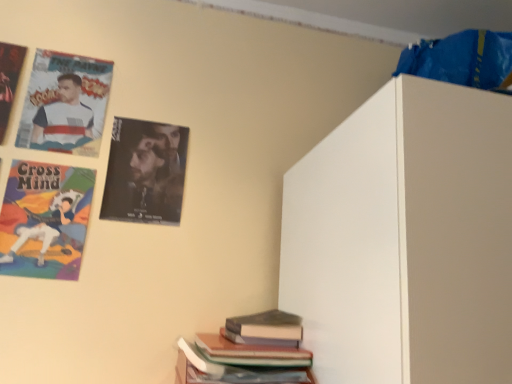
This screenshot has width=512, height=384. I want to click on hardcover book at lower right, the 1th book in the top-to-bottom sequence, so click(267, 325).

Where is `cartoon character poster at upper left`? The image size is (512, 384). cartoon character poster at upper left is located at coordinates (42, 232).

What is the approximate height of matte paper poster at upper left, the first poster from the left?

matte paper poster at upper left, the first poster from the left, is 12.12 inches tall.

Measure the distance between point (10, 51) and camera.

Point (10, 51) and camera are 3.83 feet apart from each other.

Measure the distance between point (148, 148) and camera.

3.94 feet.

In order to face black glossy poster at upper left, positioned as the first poster in right-to-left order, should I rotate leftwards or rightwards?

Turn left approximately 14.550 degrees to face it.

Where is `matte paper poster at upper left, the second poster when ordered from left to right`? matte paper poster at upper left, the second poster when ordered from left to right is located at coordinates (65, 103).

Is matte paper poster at upper left, positioned as the 3th poster in right-to-left order, to the right of matte paper poster at upper left, the second poster when ordered from left to right, from the viewer's perspective?

No.

Is matte paper poster at upper left, the first poster from the left, in contact with matte paper poster at upper left, the second poster when ordered from left to right?

matte paper poster at upper left, the first poster from the left, and matte paper poster at upper left, the second poster when ordered from left to right, are clearly separated.

From a real-world perspective, is matte paper poster at upper left, the first poster from the left, below matte paper poster at upper left, which is counted as the second poster, starting from the right?

Incorrect, from a real-world perspective, matte paper poster at upper left, the first poster from the left, is higher than matte paper poster at upper left, which is counted as the second poster, starting from the right.

Between black glossy poster at upper left, positioned as the first poster in right-to-left order, and matte paper poster at upper left, the first poster from the left, which one has smaller size?

Smaller between the two is black glossy poster at upper left, positioned as the first poster in right-to-left order.

Is black glossy poster at upper left, positioned as the first poster in right-to-left order, oriented away from matte paper poster at upper left, positioned as the 3th poster in right-to-left order?

black glossy poster at upper left, positioned as the first poster in right-to-left order, is not turned away from matte paper poster at upper left, positioned as the 3th poster in right-to-left order.

There is a black glossy poster at upper left, which is the third poster from left to right. Where is `the 2nd poster above it (from the image's perspective)`? The height and width of the screenshot is (384, 512). the 2nd poster above it (from the image's perspective) is located at coordinates (9, 80).

Considering the sizes of objects black glossy poster at upper left, positioned as the first poster in right-to-left order, and matte paper poster at upper left, positioned as the 3th poster in right-to-left order, in the image provided, who is wider, black glossy poster at upper left, positioned as the first poster in right-to-left order, or matte paper poster at upper left, positioned as the 3th poster in right-to-left order,?

With larger width is matte paper poster at upper left, positioned as the 3th poster in right-to-left order.

Between cartoon character poster at upper left and matte paper poster at upper left, the first poster from the left, which one is positioned behind?

matte paper poster at upper left, the first poster from the left, is behind.

Is cartoon character poster at upper left not close to matte paper poster at upper left, positioned as the 3th poster in right-to-left order?

cartoon character poster at upper left is near matte paper poster at upper left, positioned as the 3th poster in right-to-left order, not far away.

Considering the points (51, 219) and (5, 65), which point is behind, point (51, 219) or point (5, 65)?

Point (5, 65)

Is cartoon character poster at upper left smaller than matte paper poster at upper left, the first poster from the left?

Yes.

Is hardcover book at lower right, placed as the 2th book when sorted from bottom to top, taller or shorter than cartoon character poster at upper left?

Clearly, hardcover book at lower right, placed as the 2th book when sorted from bottom to top, is shorter compared to cartoon character poster at upper left.

How much distance is there between hardcover book at lower right, placed as the 2th book when sorted from bottom to top, and cartoon character poster at upper left?

A distance of 21.88 inches exists between hardcover book at lower right, placed as the 2th book when sorted from bottom to top, and cartoon character poster at upper left.

Is hardcover book at lower right, placed as the 2th book when sorted from bottom to top, spatially inside cartoon character poster at upper left, or outside of it?

The correct answer is: outside.

Is matte paper poster at upper left, which is counted as the second poster, starting from the right, to the right of hardcover book at lower center, the 2th book viewed from the top, from the viewer's perspective?

No.

There is a matte paper poster at upper left, the second poster when ordered from left to right. In order to click on the 2nd book below it (from a real-world perspective) in this screenshot , I will do `click(248, 352)`.

Are matte paper poster at upper left, the second poster when ordered from left to right, and hardcover book at lower center, the 2th book viewed from the top, located far from each other?

No, there isn't a large distance between matte paper poster at upper left, the second poster when ordered from left to right, and hardcover book at lower center, the 2th book viewed from the top.

Is hardcover book at lower center, marked as the first book in a bottom-to-top arrangement, turned away from hardcover book at lower right, placed as the 2th book when sorted from bottom to top?

hardcover book at lower center, marked as the first book in a bottom-to-top arrangement, is not turned away from hardcover book at lower right, placed as the 2th book when sorted from bottom to top.

Is hardcover book at lower center, the 2th book viewed from the top, surrounding hardcover book at lower right, placed as the 2th book when sorted from bottom to top?

That's incorrect, hardcover book at lower right, placed as the 2th book when sorted from bottom to top, is not inside hardcover book at lower center, the 2th book viewed from the top.

The width and height of the screenshot is (512, 384). I want to click on book above the hardcover book at lower center, the 2th book viewed from the top (from the image's perspective), so click(x=267, y=325).

Measure the distance from hardcover book at lower center, the 2th book viewed from the top, to hardcover book at lower right, placed as the 2th book when sorted from bottom to top.

hardcover book at lower center, the 2th book viewed from the top, and hardcover book at lower right, placed as the 2th book when sorted from bottom to top, are 1.59 inches apart from each other.

Is point (262, 337) positioned before point (4, 91)?

Yes.

Is hardcover book at lower right, placed as the 2th book when sorted from bottom to top, wider than matte paper poster at upper left, the first poster from the left?

Yes.

In the scene shown: Is hardcover book at lower right, the 1th book in the top-to-bottom sequence, facing away from matte paper poster at upper left, positioned as the 3th poster in right-to-left order?

No, hardcover book at lower right, the 1th book in the top-to-bottom sequence, is not facing the opposite direction of matte paper poster at upper left, positioned as the 3th poster in right-to-left order.

Which is more to the left, hardcover book at lower right, placed as the 2th book when sorted from bottom to top, or matte paper poster at upper left, positioned as the 3th poster in right-to-left order?

matte paper poster at upper left, positioned as the 3th poster in right-to-left order, is more to the left.

Which poster is the 1st one when counting from the right side of the matte paper poster at upper left, the first poster from the left? Please provide its 2D coordinates.

[(65, 103)]

From a real-world perspective, count 2nd posters upward from the black glossy poster at upper left, positioned as the first poster in right-to-left order, and point to it. Please provide its 2D coordinates.

[(9, 80)]

Looking at the image, which one is located closer to matte paper poster at upper left, which is counted as the second poster, starting from the right, black glossy poster at upper left, which is the third poster from left to right, or cartoon character poster at upper left?

black glossy poster at upper left, which is the third poster from left to right, is closer to matte paper poster at upper left, which is counted as the second poster, starting from the right.

Looking at the image, which one is located closer to matte paper poster at upper left, the first poster from the left, black glossy poster at upper left, which is the third poster from left to right, or hardcover book at lower right, the 1th book in the top-to-bottom sequence?

Based on the image, black glossy poster at upper left, which is the third poster from left to right, appears to be nearer to matte paper poster at upper left, the first poster from the left.

Looking at this image, looking at the image, which one is located further to hardcover book at lower center, the 2th book viewed from the top, matte paper poster at upper left, the first poster from the left, or black glossy poster at upper left, positioned as the first poster in right-to-left order?

matte paper poster at upper left, the first poster from the left, lies further to hardcover book at lower center, the 2th book viewed from the top, than the other object.

Considering their positions, is hardcover book at lower right, the 1th book in the top-to-bottom sequence, positioned closer to matte paper poster at upper left, the second poster when ordered from left to right, than cartoon character poster at upper left?

cartoon character poster at upper left lies closer to matte paper poster at upper left, the second poster when ordered from left to right, than the other object.

When comparing their distances from matte paper poster at upper left, the first poster from the left, does black glossy poster at upper left, which is the third poster from left to right, or hardcover book at lower center, the 2th book viewed from the top, seem further?

hardcover book at lower center, the 2th book viewed from the top, is further to matte paper poster at upper left, the first poster from the left.

Considering their positions, is matte paper poster at upper left, which is counted as the second poster, starting from the right, positioned further to hardcover book at lower center, marked as the first book in a bottom-to-top arrangement, than matte paper poster at upper left, the first poster from the left?

Among the two, matte paper poster at upper left, the first poster from the left, is located further to hardcover book at lower center, marked as the first book in a bottom-to-top arrangement.

When comparing their distances from matte paper poster at upper left, the first poster from the left, does matte paper poster at upper left, which is counted as the second poster, starting from the right, or cartoon character poster at upper left seem further?

Based on the image, cartoon character poster at upper left appears to be further to matte paper poster at upper left, the first poster from the left.

Consider the image. Which object lies further to the anchor point matte paper poster at upper left, the second poster when ordered from left to right, matte paper poster at upper left, the first poster from the left, or hardcover book at lower center, marked as the first book in a bottom-to-top arrangement?

hardcover book at lower center, marked as the first book in a bottom-to-top arrangement, lies further to matte paper poster at upper left, the second poster when ordered from left to right, than the other object.

This screenshot has width=512, height=384. Identify the location of poster between matte paper poster at upper left, the second poster when ordered from left to right, and hardcover book at lower right, the 1th book in the top-to-bottom sequence, in the vertical direction. (145, 172).

This screenshot has width=512, height=384. I want to click on book between cartoon character poster at upper left and hardcover book at lower right, placed as the 2th book when sorted from bottom to top, so click(x=248, y=352).

Locate an element on the screen. This screenshot has width=512, height=384. poster situated between matte paper poster at upper left, positioned as the 3th poster in right-to-left order, and black glossy poster at upper left, which is the third poster from left to right, from left to right is located at coordinates (65, 103).

This screenshot has height=384, width=512. Identify the location of book situated between matte paper poster at upper left, positioned as the 3th poster in right-to-left order, and hardcover book at lower right, the 1th book in the top-to-bottom sequence, from left to right. (248, 352).